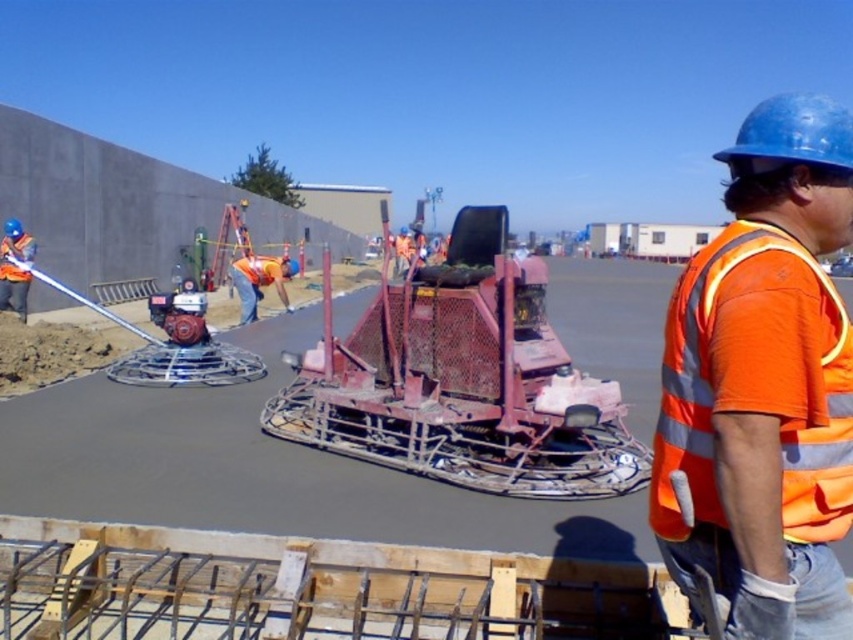
You are a safety inspector on the construction site. You notice the orange reflective vest at center and the rusty metal machine at center. Which object is larger in size?

The rusty metal machine at center is larger than the orange reflective vest at center.